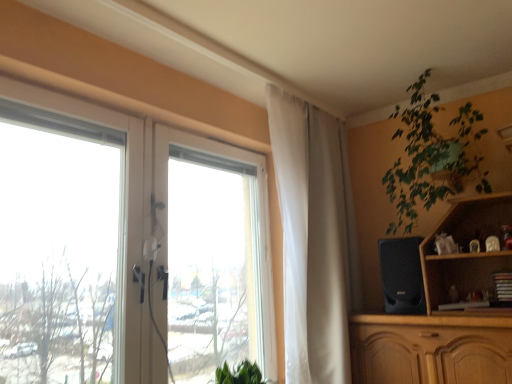
Question: Can you confirm if green leafy plant at upper right is smaller than white sheer curtain at upper center?

Choices:
 (A) yes
 (B) no

Answer: (A)

Question: From a real-world perspective, is green leafy plant at upper right on white sheer curtain at upper center?

Choices:
 (A) no
 (B) yes

Answer: (B)

Question: Is the surface of green leafy plant at upper right in direct contact with white sheer curtain at upper center?

Choices:
 (A) yes
 (B) no

Answer: (B)

Question: Can you confirm if green leafy plant at upper right is wider than white sheer curtain at upper center?

Choices:
 (A) yes
 (B) no

Answer: (A)

Question: Does green leafy plant at upper right have a greater height compared to white sheer curtain at upper center?

Choices:
 (A) no
 (B) yes

Answer: (A)

Question: Is green leafy plant at upper right to the left of white sheer curtain at upper center from the viewer's perspective?

Choices:
 (A) no
 (B) yes

Answer: (A)

Question: From a real-world perspective, is white sheer curtain at upper center under green leafy plant at upper right?

Choices:
 (A) no
 (B) yes

Answer: (B)

Question: Does white sheer curtain at upper center have a lesser width compared to green leafy plant at upper right?

Choices:
 (A) no
 (B) yes

Answer: (B)

Question: Is white sheer curtain at upper center to the right of green leafy plant at upper right from the viewer's perspective?

Choices:
 (A) no
 (B) yes

Answer: (A)

Question: From a real-world perspective, does white sheer curtain at upper center stand above green leafy plant at upper right?

Choices:
 (A) no
 (B) yes

Answer: (A)

Question: Is white sheer curtain at upper center in front of green leafy plant at upper right?

Choices:
 (A) yes
 (B) no

Answer: (B)

Question: Can you confirm if white sheer curtain at upper center is bigger than green leafy plant at upper right?

Choices:
 (A) yes
 (B) no

Answer: (A)

Question: From the image's perspective, is transparent glass window at left located beneath green leafy plant at upper right?

Choices:
 (A) no
 (B) yes

Answer: (B)